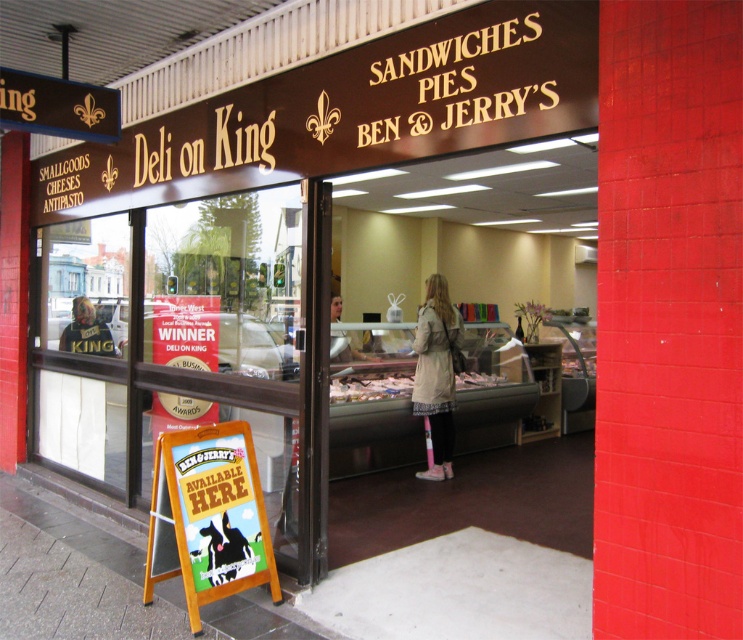
You are standing at the entrance of Deli on King. You want to locate the wooden signboard at lower left. Where should you look relative to the entrance?

The wooden signboard at lower left is located at point (x=207, y=516) relative to the entrance, so you should look towards the lower left direction from the entrance.